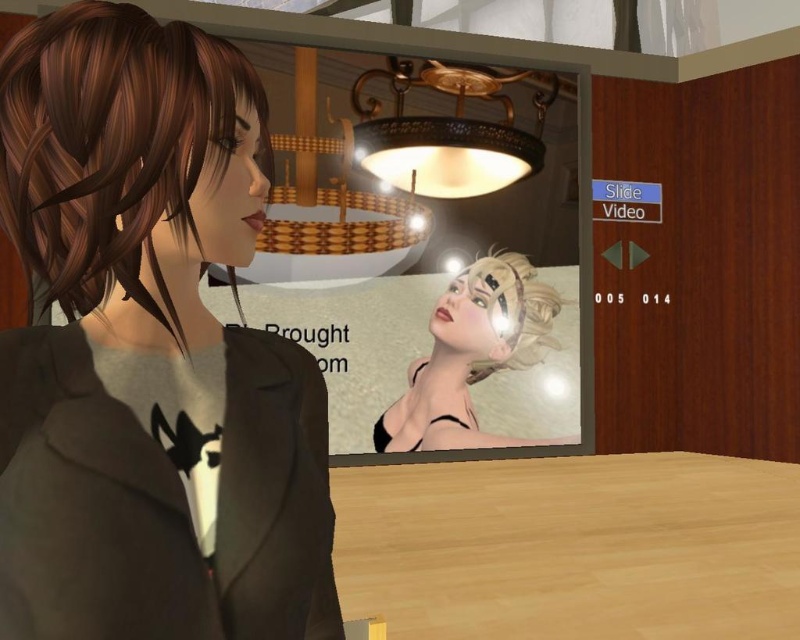
Question: Which point is closer to the camera?

Choices:
 (A) (48, 275)
 (B) (466, 285)
 (C) (498, 308)

Answer: (A)

Question: Is matte black screen at upper center to the left of smooth beige headband at center from the viewer's perspective?

Choices:
 (A) no
 (B) yes

Answer: (B)

Question: Among these points, which one is nearest to the camera?

Choices:
 (A) coord(328,326)
 (B) coord(84,282)
 (C) coord(421,388)

Answer: (B)

Question: From the image, what is the correct spatial relationship of matte gray hoodie at center in relation to matte black screen at upper center?

Choices:
 (A) right
 (B) left

Answer: (B)

Question: Which point is closer to the camera?

Choices:
 (A) (509, 257)
 (B) (52, 208)
 (C) (64, 166)

Answer: (C)

Question: In this image, where is matte gray hoodie at center located relative to shiny brown hair at left?

Choices:
 (A) above
 (B) below

Answer: (B)